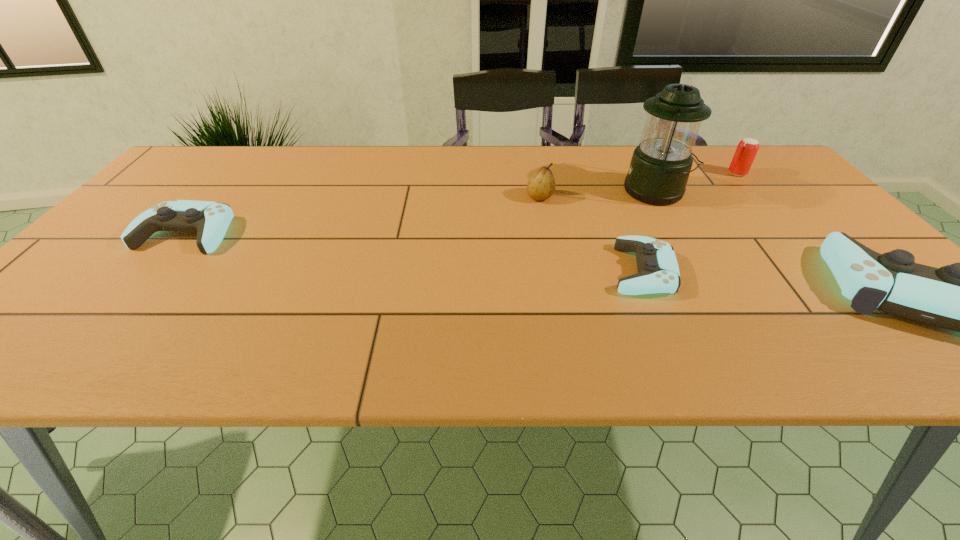
Locate an element on the screen. The width and height of the screenshot is (960, 540). vacant region located 0.310m on the left of the tallest object is located at coordinates (512, 192).

Locate an element on the screen. This screenshot has width=960, height=540. vacant space located 0.180m on the front of the fifth object from right to left is located at coordinates (549, 247).

Where is `beer can positioned at the far edge`? This screenshot has width=960, height=540. beer can positioned at the far edge is located at coordinates (747, 148).

This screenshot has width=960, height=540. I want to click on lantern at the far edge, so click(660, 166).

Identify the location of object that is at the near edge. (658, 272).

Locate an element on the screen. object at the left edge is located at coordinates (210, 220).

Where is `object at the right edge`? object at the right edge is located at coordinates (747, 148).

Identify the location of object situated at the far right corner. The image size is (960, 540). (x=747, y=148).

The height and width of the screenshot is (540, 960). Identify the location of free region at the far edge of the desktop. (600, 181).

What are the coordinates of `vacant space at the near edge` in the screenshot? It's located at (184, 308).